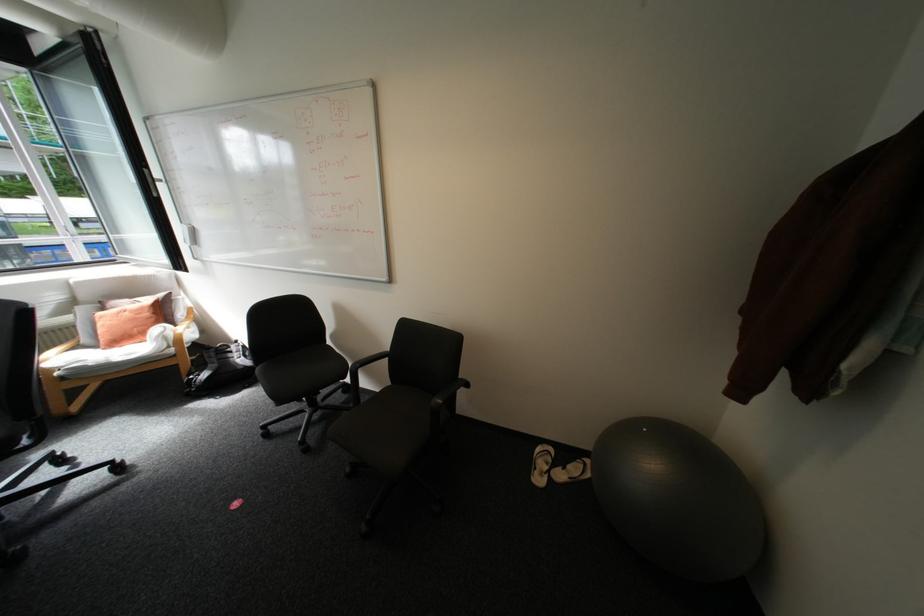
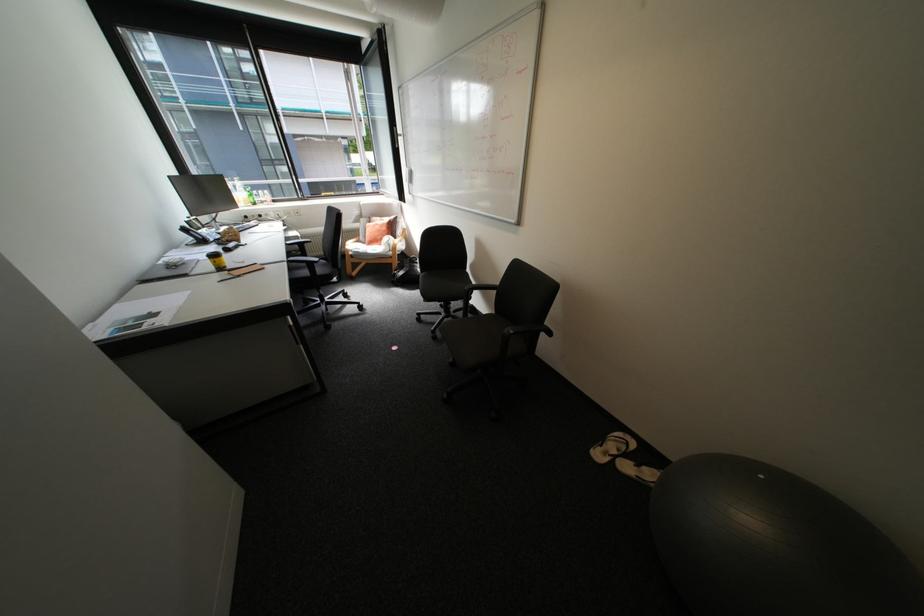
In the second image, find the point that corresponds to point (573, 469) in the first image.

(645, 464)